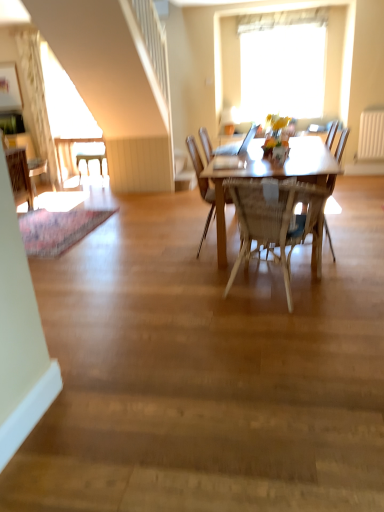
Find the location of a particular element. Image resolution: width=384 pixels, height=512 pixels. vacant position to the left of woven wood chair at center, which appears as the 1th chair when viewed from the front is located at coordinates (193, 291).